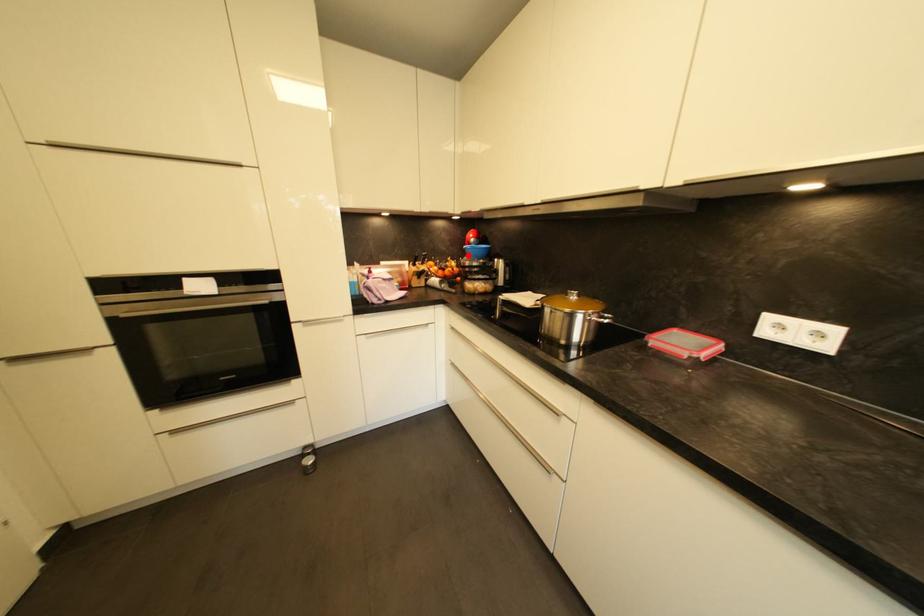
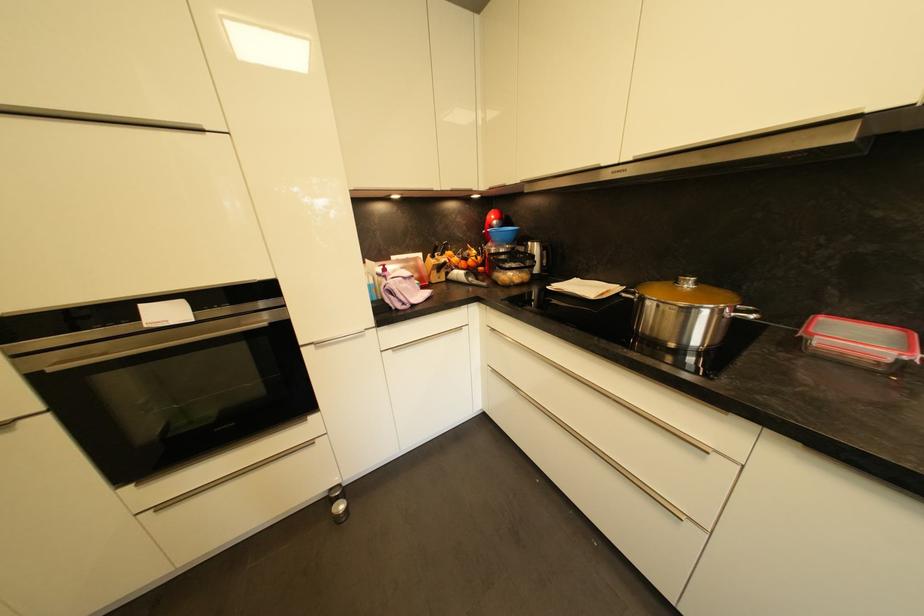
Locate, in the second image, the point that corresponds to the highlighted location in the first image.

(492, 240)